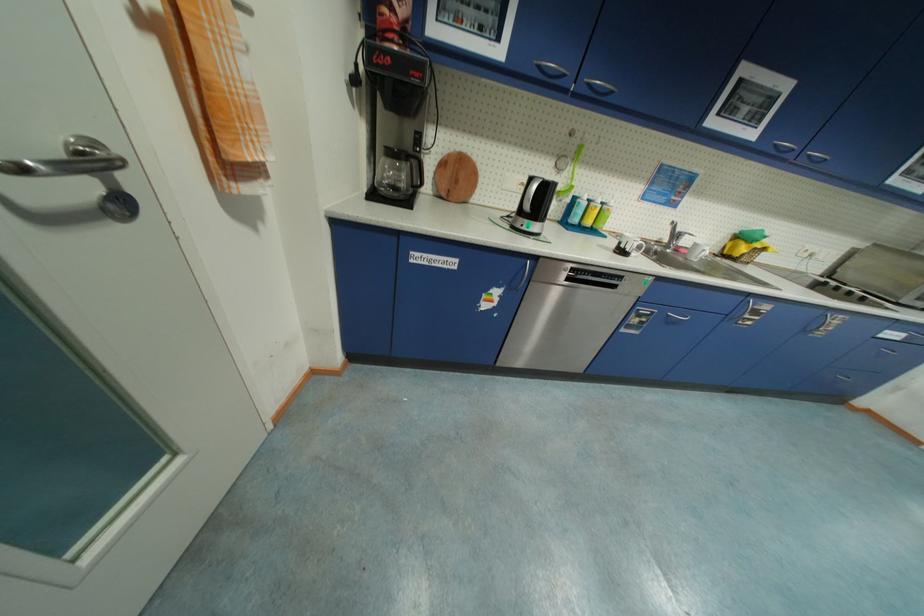
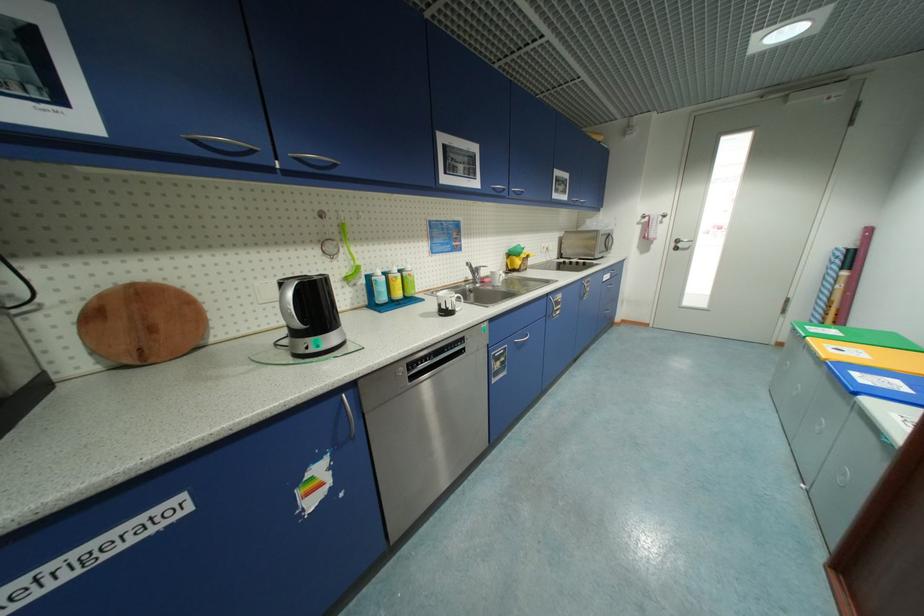
In the second image, find the point that corresponds to the point at 574,169 in the first image.

(347, 251)